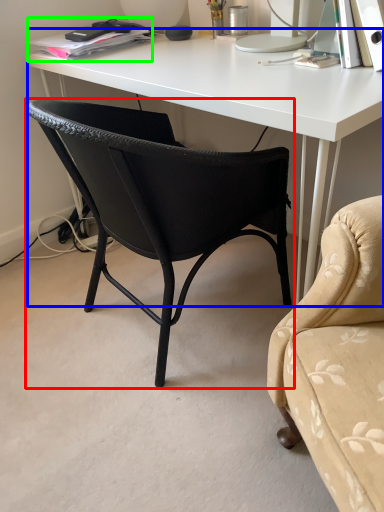
Question: Which object is the farthest from chair (highlighted by a red box)? Choose among these: desk (highlighted by a blue box) or book (highlighted by a green box).

Choices:
 (A) desk
 (B) book

Answer: (B)